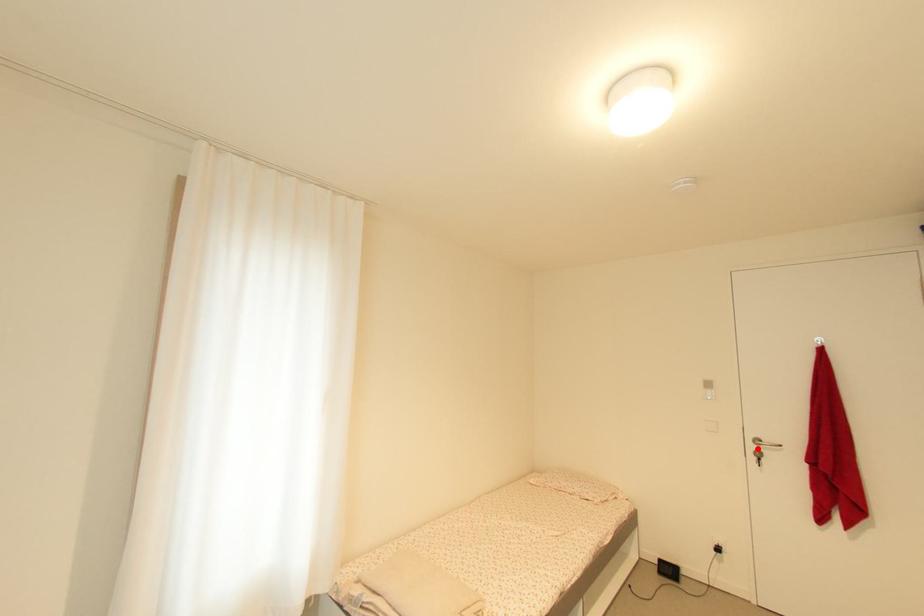
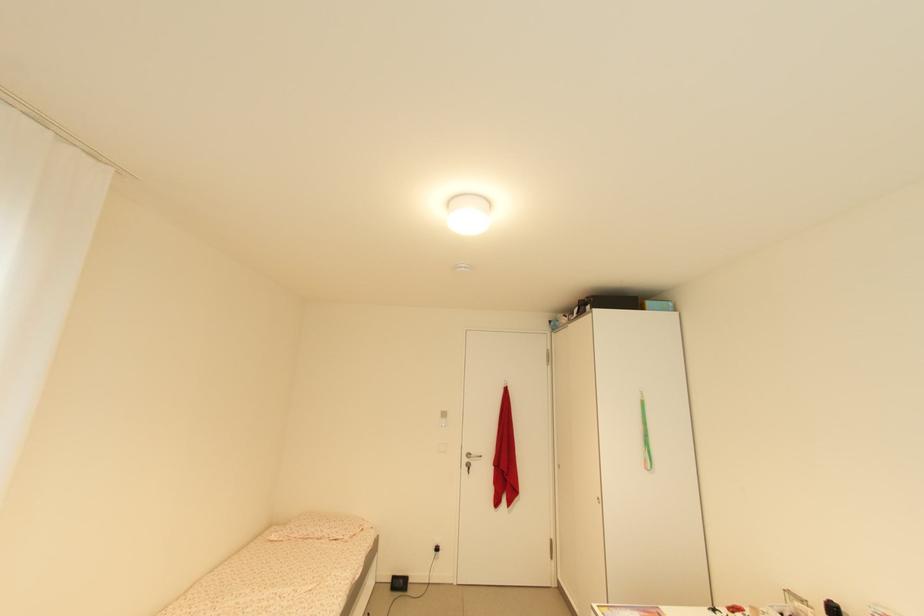
In the second image, find the point that corresponds to the highlighted location in the first image.

(470, 461)